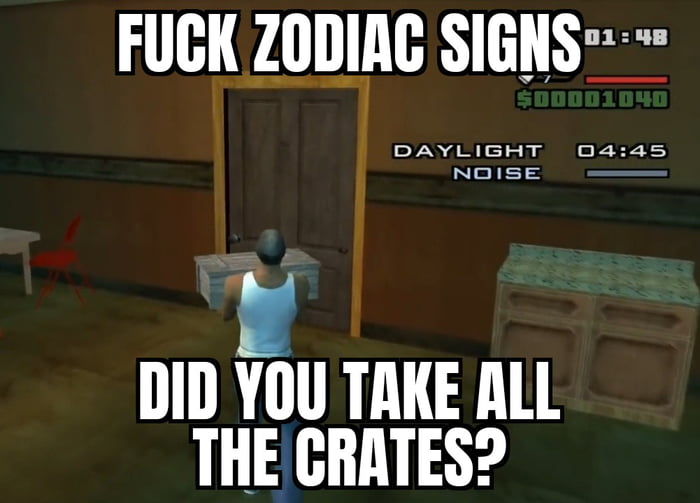
Image resolution: width=700 pixels, height=503 pixels. I want to click on door knob, so click(234, 239).